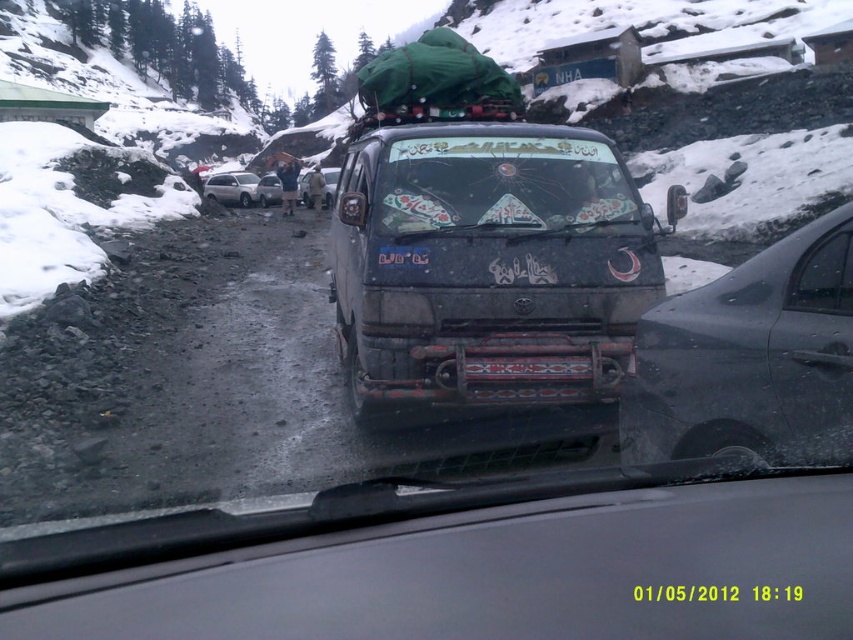
You are a passenger in a car driving on an icy road. You notice a decorative glass windshield at center. Where exactly is it located in the image?

The decorative glass windshield at center is located at point coordinates of (x=500, y=184).

You are driving a car and see the image. There is a decorative glass windshield at center. Where exactly is the decorative glass windshield located in relation to the point marked at coordinates (500, 184)?

The decorative glass windshield at center is exactly located at the point marked at coordinates (500, 184).

You are driving a car and see the decorative glass windshield at center and the metallic silver van at center in front of you. Which object is closer to you?

The decorative glass windshield at center is closer to you because it is in front of the metallic silver van at center.